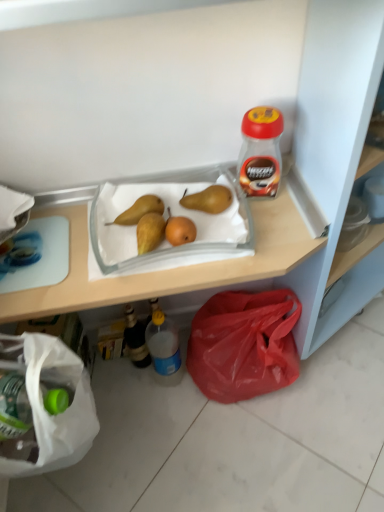
You are a GUI agent. You are given a task and a screenshot of the screen. Output one action in this format:
    pyautogui.click(x=<x>, y=<y>)
    Task: Click on the vacant space situated on the left part of red plastic bag at lower right
    The height and width of the screenshot is (512, 384).
    Given the screenshot: What is the action you would take?
    pyautogui.click(x=149, y=403)